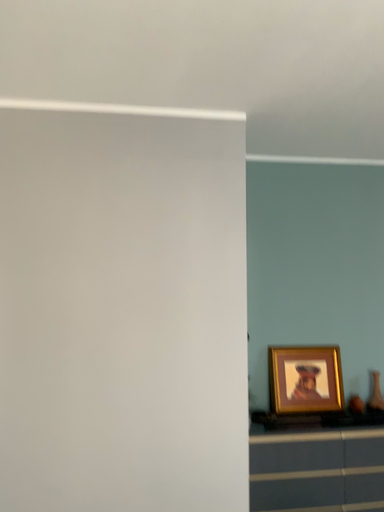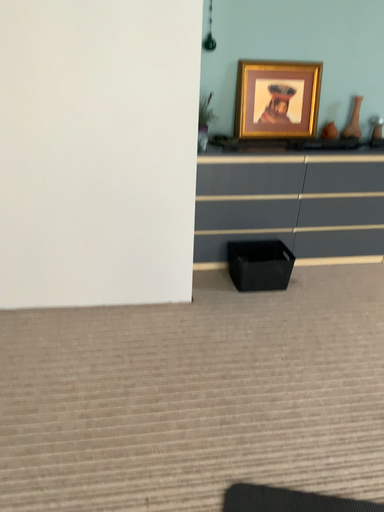
Question: Which way did the camera rotate in the video?

Choices:
 (A) rotated upward
 (B) rotated downward

Answer: (B)